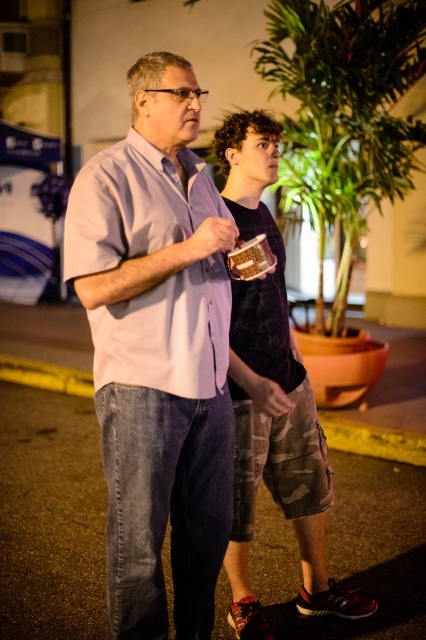
Which of these two, light purple cotton shirt at center or dark blue t-shirt at center, stands taller?

With more height is dark blue t-shirt at center.

Between light purple cotton shirt at center and dark blue t-shirt at center, which one is positioned lower?

Positioned lower is dark blue t-shirt at center.

Find the location of `light purple cotton shirt at center`. light purple cotton shirt at center is located at coordinates (158, 353).

Find the location of `light purple cotton shirt at center`. light purple cotton shirt at center is located at coordinates (158, 353).